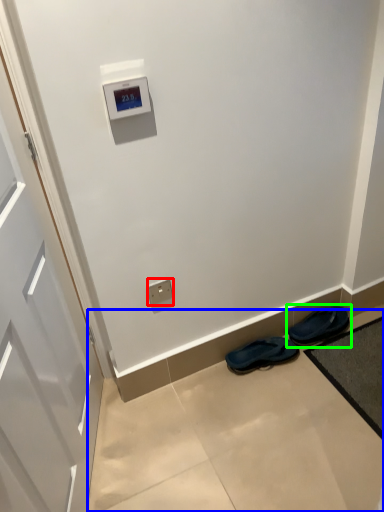
Question: Estimate the real-world distances between objects in this image. Which object is closer to electric outlet (highlighted by a red box), concrete (highlighted by a blue box) or footwear (highlighted by a green box)?

Choices:
 (A) concrete
 (B) footwear

Answer: (A)